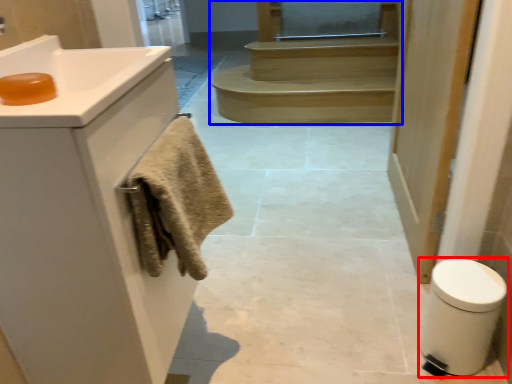
Question: Which of the following is the closest to the observer, bidet (highlighted by a red box) or stairs (highlighted by a blue box)?

Choices:
 (A) bidet
 (B) stairs

Answer: (A)